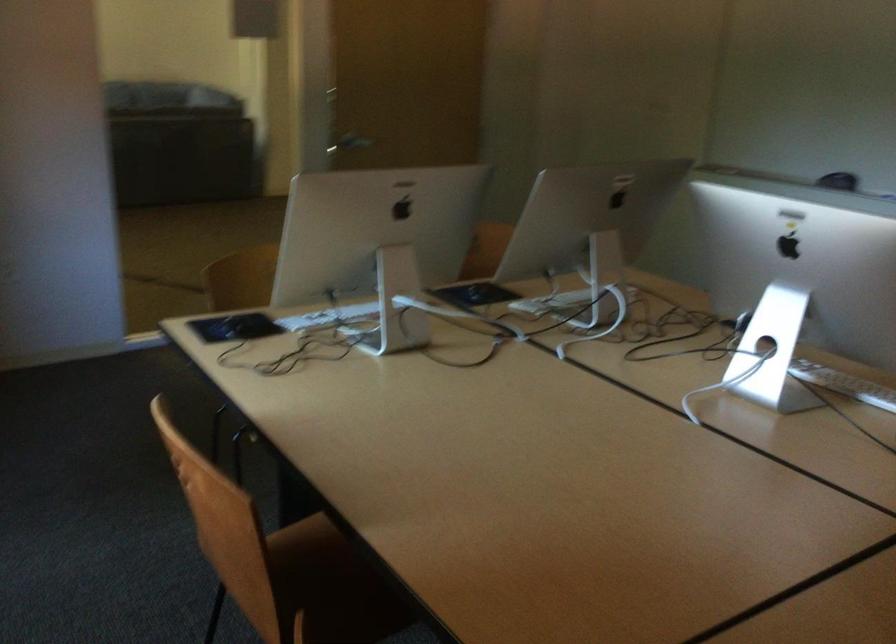
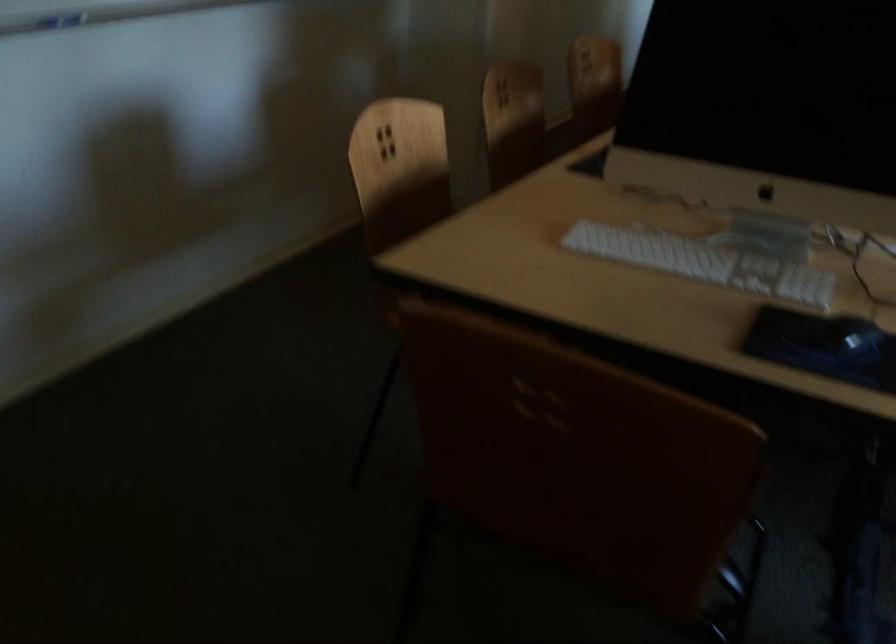
Locate, in the second image, the point that corresponds to point (572, 299) in the first image.

(702, 261)